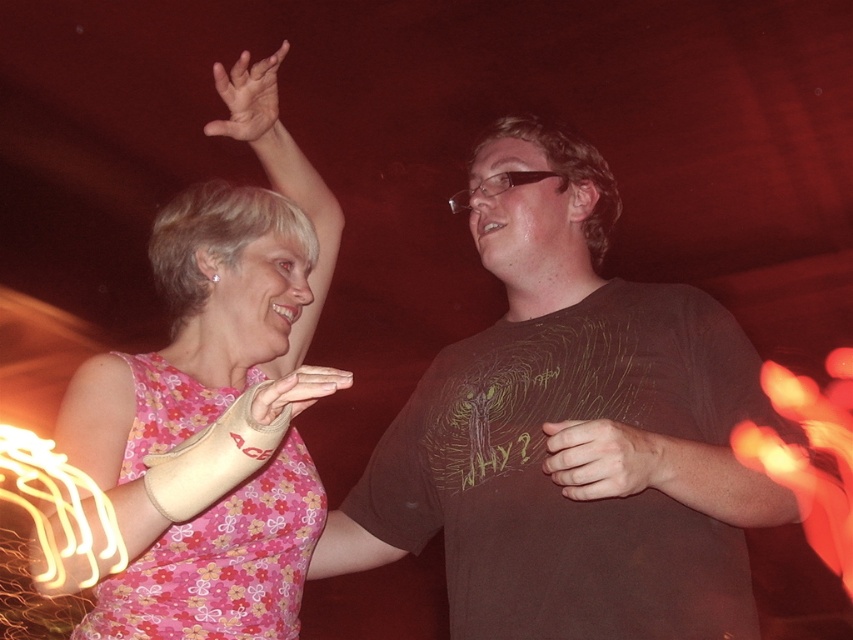
Question: Which point is closer to the camera?

Choices:
 (A) pink floral dress at upper left
 (B) smooth skin hand at center
 (C) white fabric cast at upper center

Answer: (C)

Question: From the image, what is the correct spatial relationship of brown matte t-shirt at center in relation to smooth skin hand at center?

Choices:
 (A) below
 (B) above

Answer: (B)

Question: Which of the following is the farthest from the observer?

Choices:
 (A) pos(215,74)
 (B) pos(254,508)

Answer: (A)

Question: Can you confirm if brown matte t-shirt at center is thinner than smooth skin hand at center?

Choices:
 (A) no
 (B) yes

Answer: (A)

Question: Which of the following is the farthest from the observer?

Choices:
 (A) (302, 474)
 (B) (325, 381)
 (C) (235, 132)

Answer: (C)

Question: Can you confirm if smooth skin hand at center is smaller than white fabric cast at upper center?

Choices:
 (A) no
 (B) yes

Answer: (B)